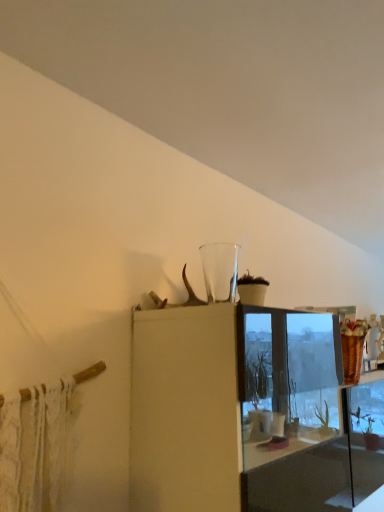
The image size is (384, 512). I want to click on transparent glass vase at upper center, so click(220, 271).

The image size is (384, 512). What do you see at coordinates (220, 271) in the screenshot?
I see `transparent glass vase at upper center` at bounding box center [220, 271].

The width and height of the screenshot is (384, 512). I want to click on transparent glass vase at upper center, so click(220, 271).